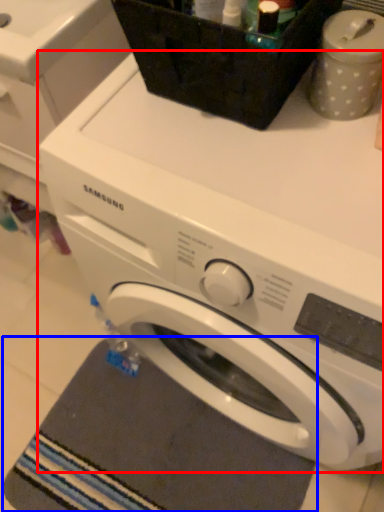
Question: Among these objects, which one is farthest to the camera, washing machine (highlighted by a red box) or bath mat (highlighted by a blue box)?

Choices:
 (A) washing machine
 (B) bath mat

Answer: (B)